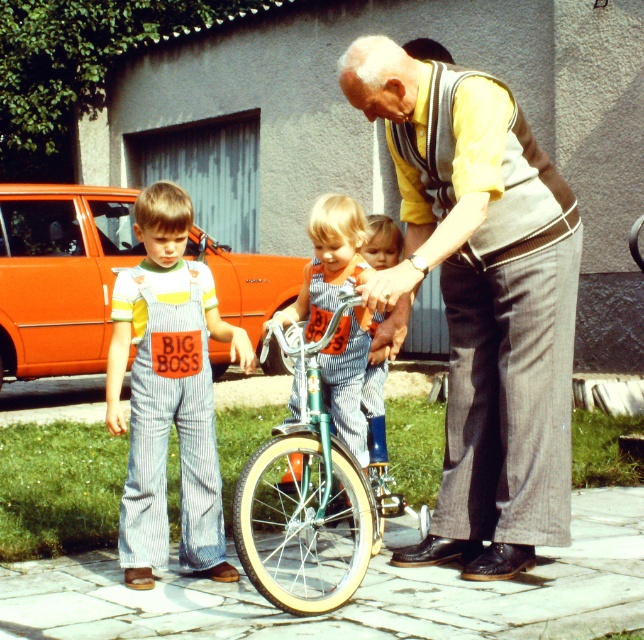
You are a delivery person trying to park your delivery cart between the denim overalls at center and the green metallic bicycle at center. The cart is 1.2 meters wide. Can you fit your cart between them?

The denim overalls at center is narrower than the green metallic bicycle at center, but the exact distance between them isn

You are a delivery person trying to deliver a package to the address shown in the image. You need to place the package on the ground between the denim overalls at center and the green metallic bicycle at center. Is there enough space for the package?

The denim overalls at center is above the green metallic bicycle at center, meaning they are vertically aligned. Since the package needs to be placed on the ground between them horizontally, there might not be enough space if they are stacked vertically. Check the horizontal distance before placing the package.